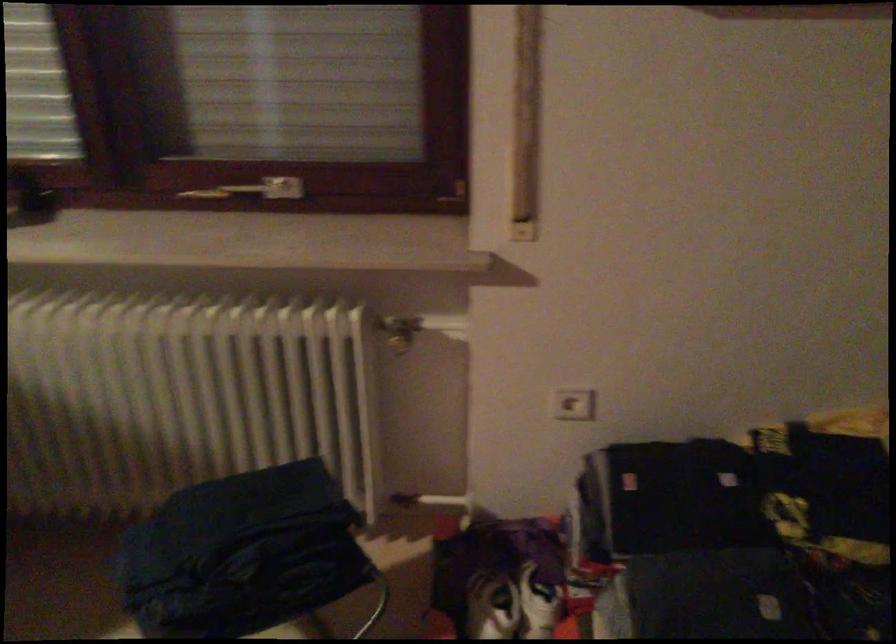
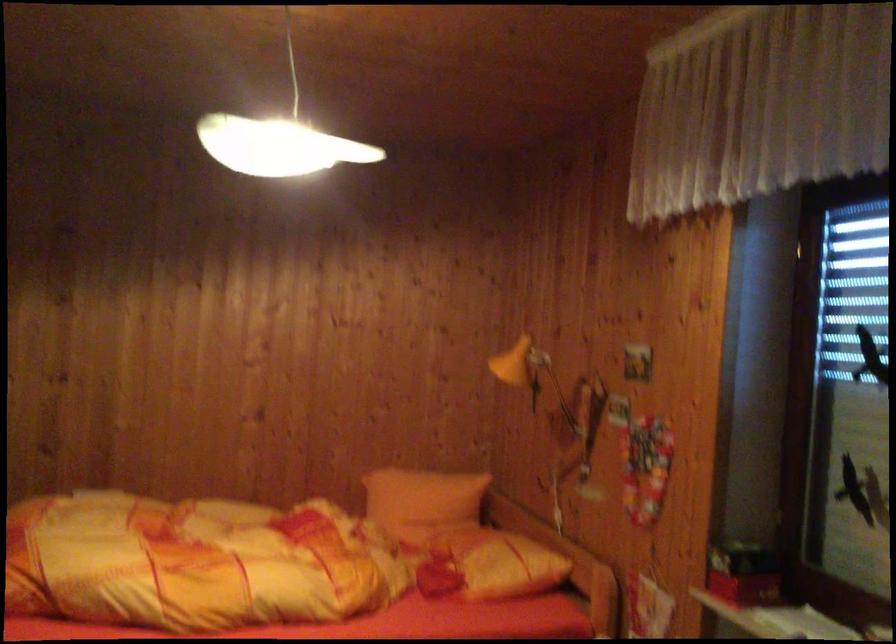
Question: The first image is from the beginning of the video and the second image is from the end. How did the camera likely rotate when shooting the video?

Choices:
 (A) Left
 (B) Right
 (C) Up
 (D) Down

Answer: (A)